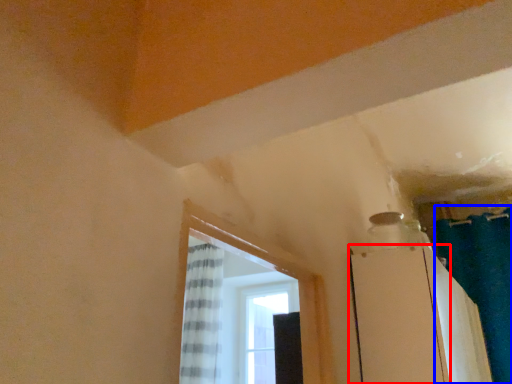
Question: Which object appears farthest to the camera in this image, screen door (highlighted by a red box) or shower curtain (highlighted by a blue box)?

Choices:
 (A) screen door
 (B) shower curtain

Answer: (B)